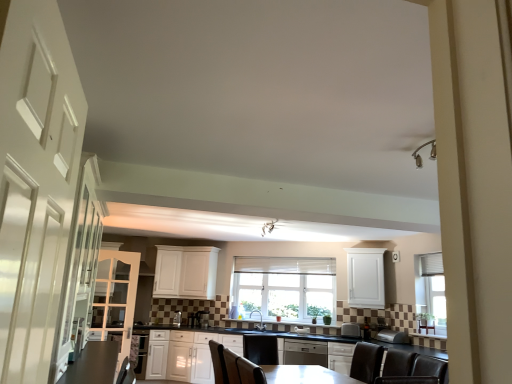
Question: Is white glossy cabinets at center, which appears as the 3th cabinetry when viewed from the left, turned away from satin silver toaster at lower center, which ranks as the 2th appliance in back-to-front order?

Choices:
 (A) no
 (B) yes

Answer: (A)

Question: Considering the relative sizes of white glossy cabinets at center, the third cabinetry from the right, and satin silver toaster at lower center, which ranks as the 2th appliance in back-to-front order, in the image provided, is white glossy cabinets at center, the third cabinetry from the right, thinner than satin silver toaster at lower center, which ranks as the 2th appliance in back-to-front order,?

Choices:
 (A) yes
 (B) no

Answer: (B)

Question: Is white glossy cabinets at center, which appears as the 3th cabinetry when viewed from the left, located outside satin silver toaster at lower center, the 2th appliance viewed from the front?

Choices:
 (A) no
 (B) yes

Answer: (B)

Question: From a real-world perspective, is white glossy cabinets at center, which appears as the 3th cabinetry when viewed from the left, on top of satin silver toaster at lower center, positioned as the 3th appliance in right-to-left order?

Choices:
 (A) yes
 (B) no

Answer: (B)

Question: Does white glossy cabinets at center, which appears as the 3th cabinetry when viewed from the left, have a smaller size compared to satin silver toaster at lower center, the 2th appliance viewed from the front?

Choices:
 (A) no
 (B) yes

Answer: (A)

Question: In terms of size, does satin silver toaster at lower center, the 1th appliance positioned from the right, appear bigger or smaller than satin nickel faucet at center?

Choices:
 (A) big
 (B) small

Answer: (A)

Question: Based on their positions, is satin silver toaster at lower center, the 3th appliance positioned from the left, located to the left or right of satin nickel faucet at center?

Choices:
 (A) right
 (B) left

Answer: (A)

Question: Considering their positions, is satin silver toaster at lower center, the 1th appliance positioned from the right, located in front of or behind satin nickel faucet at center?

Choices:
 (A) front
 (B) behind

Answer: (A)

Question: From the image's perspective, is satin silver toaster at lower center, acting as the third appliance starting from the back, above or below satin nickel faucet at center?

Choices:
 (A) below
 (B) above

Answer: (B)

Question: Is white glossy door at left taller or shorter than white matte cabinet at center, acting as the second cabinetry starting from the left?

Choices:
 (A) tall
 (B) short

Answer: (B)

Question: Does point (15, 322) appear closer or farther from the camera than point (204, 249)?

Choices:
 (A) closer
 (B) farther

Answer: (A)

Question: Considering the relative positions of white glossy door at left and white matte cabinet at center, acting as the second cabinetry starting from the left, in the image provided, is white glossy door at left to the left or to the right of white matte cabinet at center, acting as the second cabinetry starting from the left,?

Choices:
 (A) left
 (B) right

Answer: (B)

Question: From the image's perspective, is white glossy door at left above or below white matte cabinet at center, acting as the second cabinetry starting from the left?

Choices:
 (A) below
 (B) above

Answer: (B)

Question: In terms of height, does satin black dishwasher at center look taller or shorter compared to white textured window at center?

Choices:
 (A) tall
 (B) short

Answer: (B)

Question: From the image's perspective, is satin black dishwasher at center positioned above or below white textured window at center?

Choices:
 (A) below
 (B) above

Answer: (A)